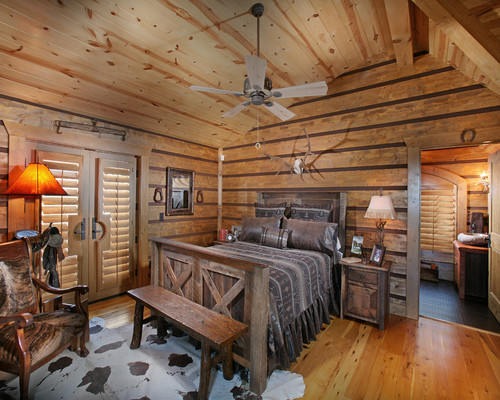
Image resolution: width=500 pixels, height=400 pixels. Identify the location of bed. (298, 274).